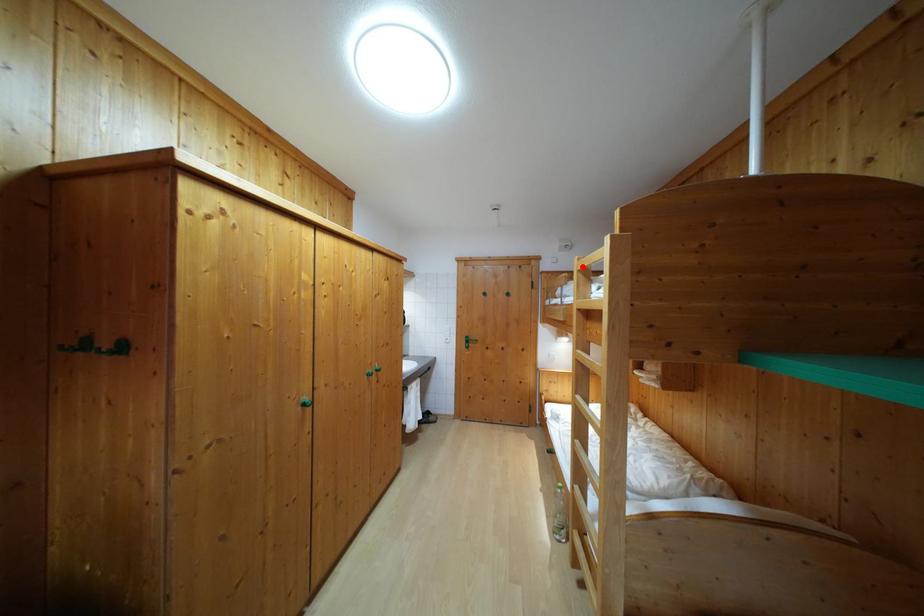
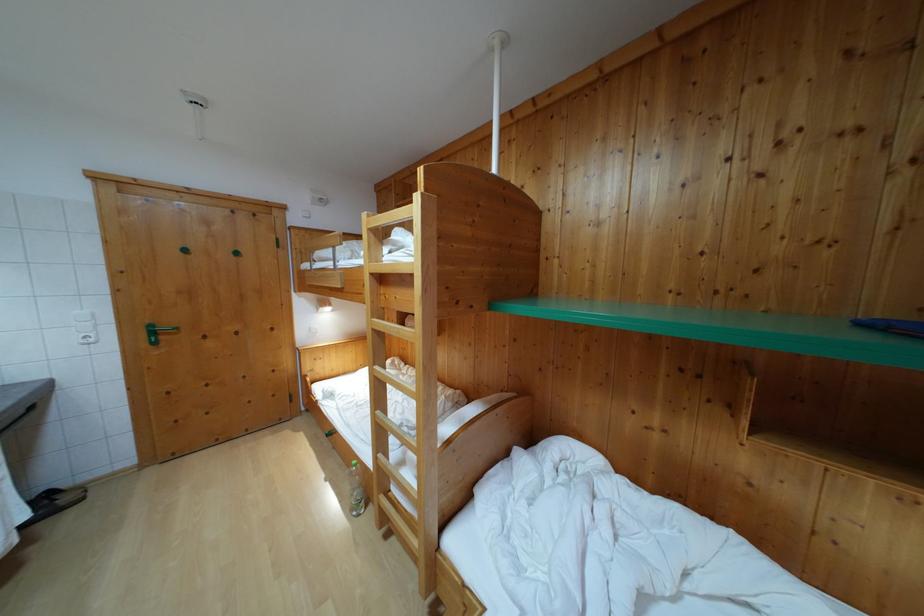
Question: I am providing you with two images of the same scene from different viewpoints. Given a red point in image1, look at the same physical point in image2. Is it:

Choices:
 (A) Closer to the viewpoint
 (B) Farther from the viewpoint

Answer: (A)